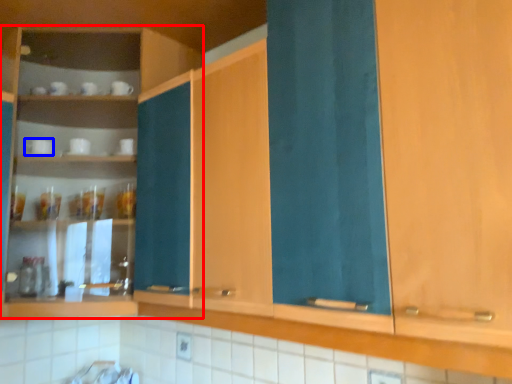
Question: Which object is closer to the camera taking this photo, cabinetry (highlighted by a red box) or tableware (highlighted by a blue box)?

Choices:
 (A) cabinetry
 (B) tableware

Answer: (A)